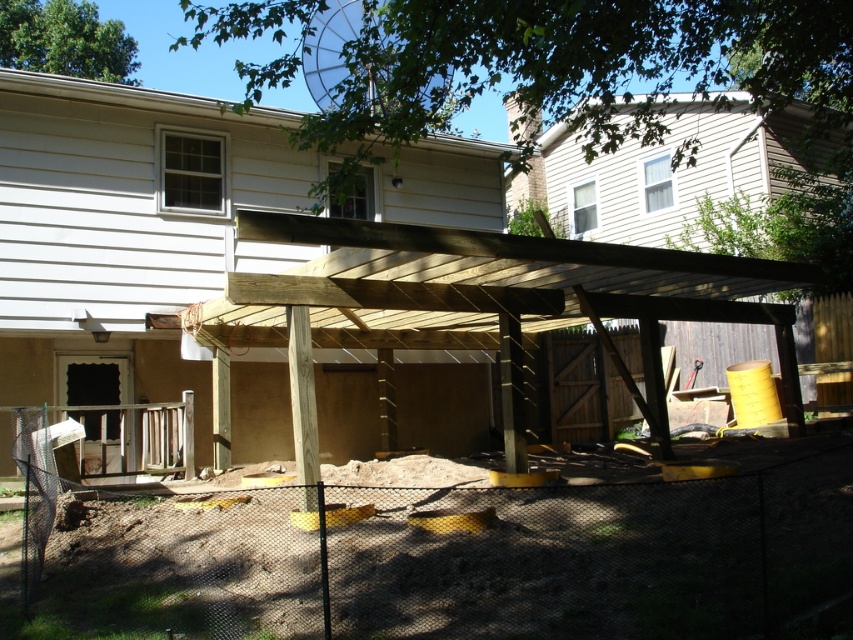
You are a delivery person trying to deliver a package to the house on the left. You see the black mesh fence at lower center and the wooden pergola at center in your way. Can you walk through the space between them to reach the house?

The black mesh fence at lower center and the wooden pergola at center are 5.02 meters apart from each other. Since the distance between them is sufficient for a person to walk through, you can pass between them to reach the house on the left.

You are a delivery person with a cart that is 1.2 meters wide. You need to deliver supplies to the construction site in the backyard. The wooden pergola at center is in the way. Can you safely navigate around it to reach the construction area?

The wooden pergola at center is 8.99 meters away from the viewer. Since the distance is sufficient, the delivery person can safely navigate around the wooden pergola at center to reach the construction area with their 1.2 meter wide cart.

You are a contractor inspecting the backyard construction site. You need to determine if the black mesh fence at lower center can be moved closer to the wooden pergola at center without affecting its structural integrity. Based on their sizes, what should you consider?

The black mesh fence at lower center is smaller than wooden pergola at center. Since the fence is smaller, it can potentially be moved closer as long as it doesn not interfere with the pergola structure, but you should also check local building codes and ensure it doesn not compromise the pergola foundation.